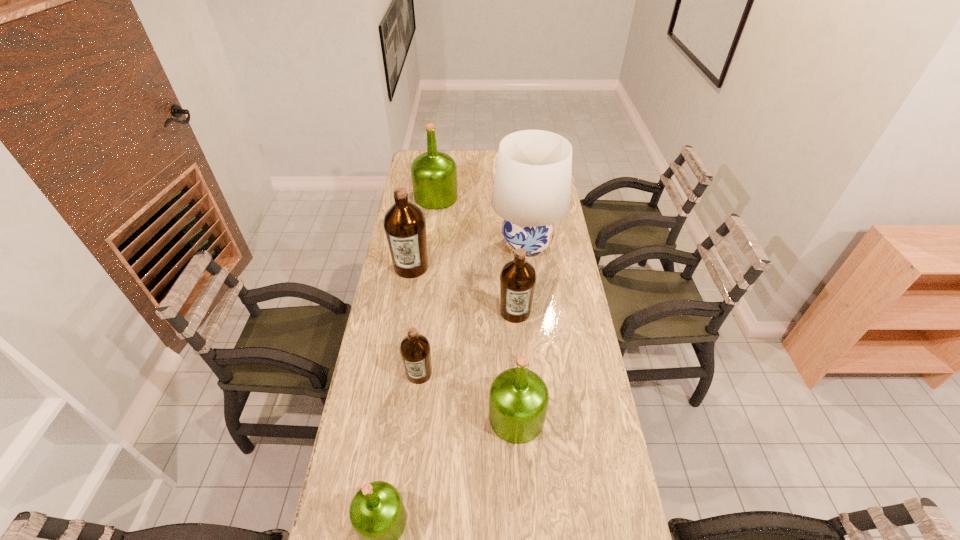
The image size is (960, 540). In order to click on object that is at the right edge in this screenshot , I will do `click(532, 185)`.

Locate an element on the screen. blank space at the far edge of the desktop is located at coordinates (462, 164).

You are a GUI agent. You are given a task and a screenshot of the screen. Output one action in this format:
    pyautogui.click(x=<x>, y=<y>)
    Task: Click on the vacant space at the left edge of the desktop
    Image resolution: width=960 pixels, height=540 pixels.
    Given the screenshot: What is the action you would take?
    pyautogui.click(x=332, y=524)

Locate an element on the screen. The width and height of the screenshot is (960, 540). vacant area at the right edge of the desktop is located at coordinates 563,312.

Identify the location of blank region between the third nearest object and the rightmost brown olive oil. The width and height of the screenshot is (960, 540). (468, 342).

Image resolution: width=960 pixels, height=540 pixels. I want to click on vacant area that lies between the second farthest olive oil and the fourth farthest olive oil, so click(x=416, y=320).

Locate an element on the screen. Image resolution: width=960 pixels, height=540 pixels. free space between the rightmost brown olive oil and the rightmost green olive oil is located at coordinates (516, 364).

Find the location of a particular element. This screenshot has height=540, width=960. blank region between the second farthest green olive oil and the biggest brown olive oil is located at coordinates (464, 342).

You are a GUI agent. You are given a task and a screenshot of the screen. Output one action in this format:
    pyautogui.click(x=<x>, y=<y>)
    Task: Click on the empty space that is in between the tallest object and the fourth farthest olive oil
    The height and width of the screenshot is (540, 960).
    Given the screenshot: What is the action you would take?
    pyautogui.click(x=473, y=309)

The height and width of the screenshot is (540, 960). I want to click on object that is the third nearest to the second farthest brown olive oil, so click(518, 398).